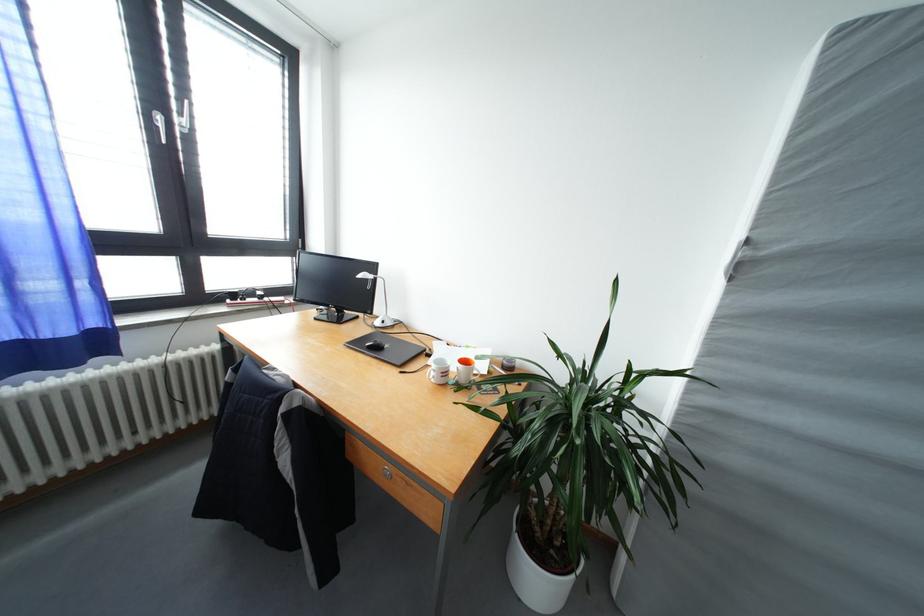
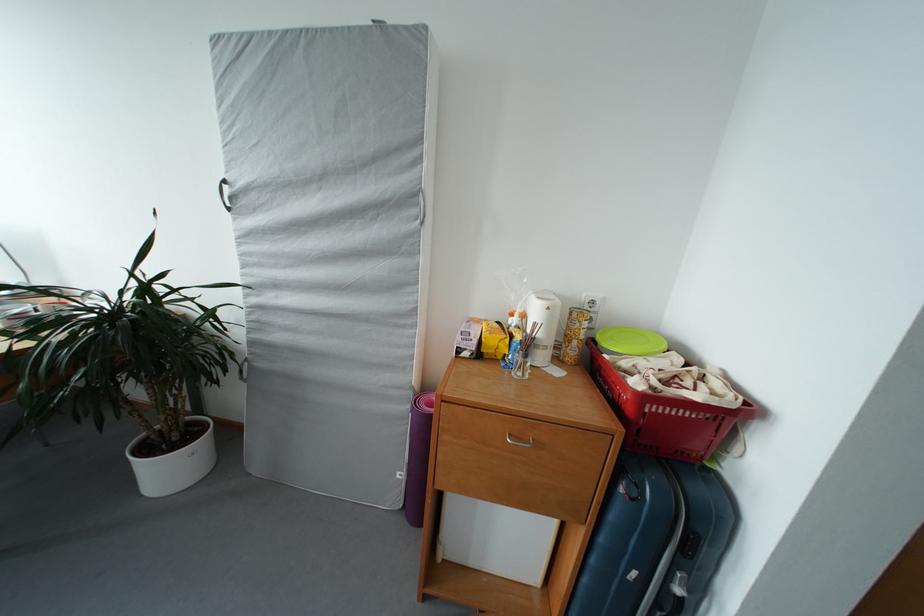
Which direction would the cameraman need to move to produce the second image?

The movement direction of the cameraman is right, backward.